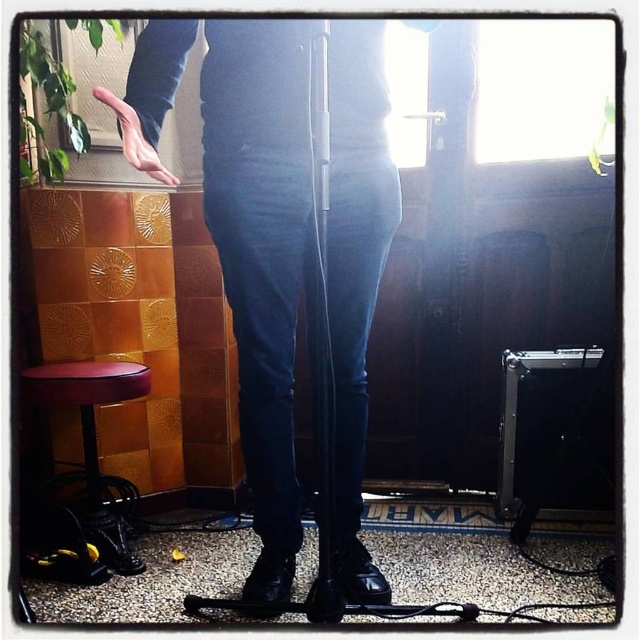
Question: Does matte black boots at center come in front of leather bar stool at lower left?

Choices:
 (A) yes
 (B) no

Answer: (A)

Question: Can you confirm if leather bar stool at lower left is positioned to the right of transparent plastic microphone at center?

Choices:
 (A) yes
 (B) no

Answer: (B)

Question: Does matte black boots at center lie behind leather bar stool at lower left?

Choices:
 (A) yes
 (B) no

Answer: (B)

Question: Which of the following is the closest to the observer?

Choices:
 (A) matte skin hand at center
 (B) matte black boots at center
 (C) transparent plastic microphone at center
 (D) leather bar stool at lower left

Answer: (A)

Question: Which object is positioned closest to the matte black boots at center?

Choices:
 (A) matte skin hand at center
 (B) leather bar stool at lower left
 (C) transparent plastic microphone at center

Answer: (A)

Question: Among these objects, which one is nearest to the camera?

Choices:
 (A) transparent plastic microphone at center
 (B) matte black boots at center

Answer: (A)